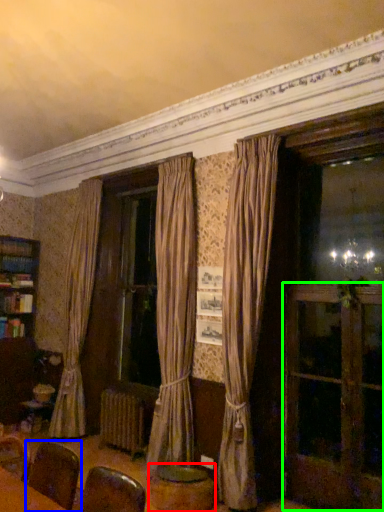
Question: Which object is the farthest from round table (highlighted by a red box)? Choose among these: armchair (highlighted by a blue box) or screen door (highlighted by a green box).

Choices:
 (A) armchair
 (B) screen door

Answer: (A)